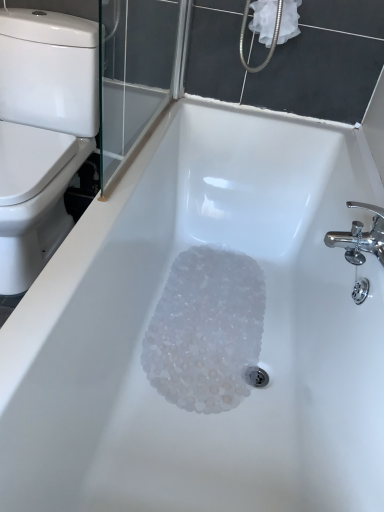
Question: From a real-world perspective, is white glossy toilet at left on top of white fabric at upper right?

Choices:
 (A) yes
 (B) no

Answer: (B)

Question: Is white fabric at upper right inside white glossy toilet at left?

Choices:
 (A) no
 (B) yes

Answer: (A)

Question: Is white glossy toilet at left at the right side of white fabric at upper right?

Choices:
 (A) yes
 (B) no

Answer: (B)

Question: From a real-world perspective, is white glossy toilet at left beneath white fabric at upper right?

Choices:
 (A) yes
 (B) no

Answer: (A)

Question: Does white glossy toilet at left have a greater width compared to white fabric at upper right?

Choices:
 (A) yes
 (B) no

Answer: (A)

Question: From the image's perspective, is translucent plastic crystals at bottom positioned above or below white glossy toilet at left?

Choices:
 (A) above
 (B) below

Answer: (B)

Question: From a real-world perspective, is translucent plastic crystals at bottom physically located above or below white glossy toilet at left?

Choices:
 (A) below
 (B) above

Answer: (A)

Question: Looking at their shapes, would you say translucent plastic crystals at bottom is wider or thinner than white glossy toilet at left?

Choices:
 (A) wide
 (B) thin

Answer: (B)

Question: Based on their sizes in the image, would you say translucent plastic crystals at bottom is bigger or smaller than white glossy toilet at left?

Choices:
 (A) big
 (B) small

Answer: (B)

Question: Is white glossy toilet at left inside or outside of white fabric at upper right?

Choices:
 (A) inside
 (B) outside

Answer: (B)

Question: From a real-world perspective, is white glossy toilet at left physically located above or below white fabric at upper right?

Choices:
 (A) above
 (B) below

Answer: (B)

Question: In terms of height, does white glossy toilet at left look taller or shorter compared to white fabric at upper right?

Choices:
 (A) short
 (B) tall

Answer: (B)

Question: From the image's perspective, relative to white fabric at upper right, is white glossy toilet at left above or below?

Choices:
 (A) below
 (B) above

Answer: (A)

Question: Is white fabric at upper right inside the boundaries of translucent plastic crystals at bottom, or outside?

Choices:
 (A) outside
 (B) inside

Answer: (A)

Question: Based on their positions, is white fabric at upper right located to the left or right of translucent plastic crystals at bottom?

Choices:
 (A) right
 (B) left

Answer: (A)